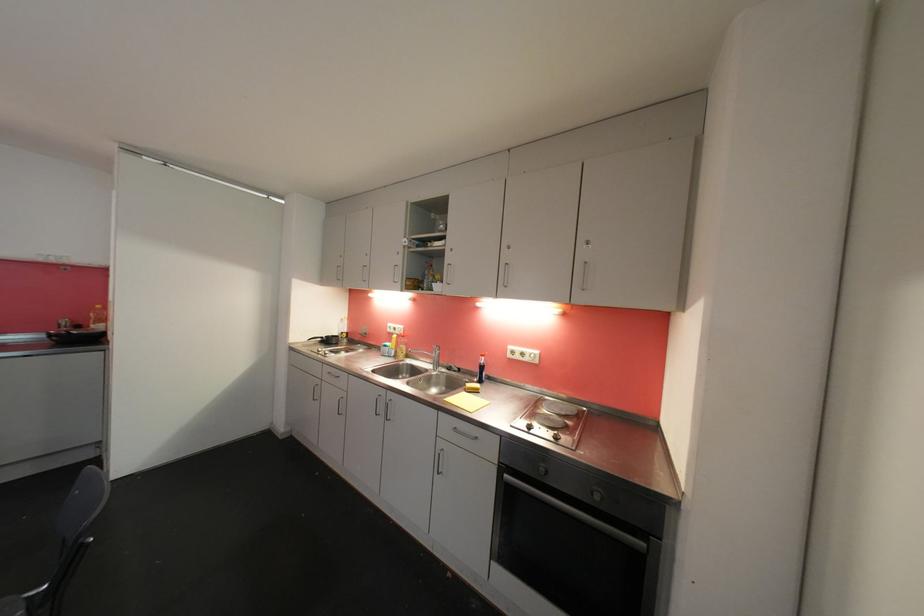
Where would you turn the faucet handle? Please return your answer as a coordinate pair (x, y).

(434, 345)